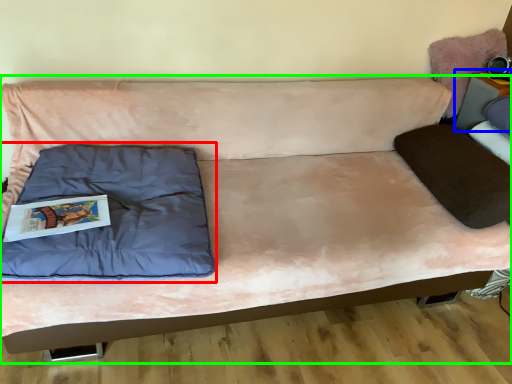
Question: Based on their relative distances, which object is nearer to pillow (highlighted by a red box)? Choose from table (highlighted by a blue box) and studio couch (highlighted by a green box).

Choices:
 (A) table
 (B) studio couch

Answer: (B)